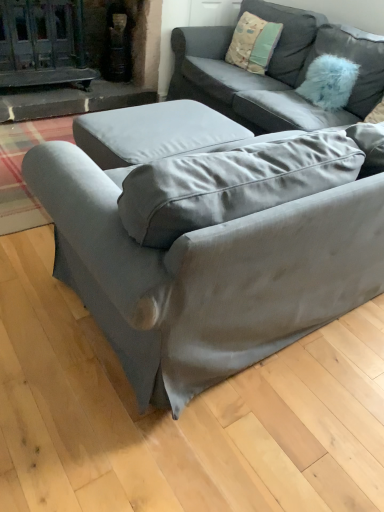
Question: Is textured cotton pillow at upper right, acting as the second pillow starting from the right, to the right of satin gray couch at center, acting as the 2th studio couch starting from the back, from the viewer's perspective?

Choices:
 (A) no
 (B) yes

Answer: (B)

Question: Does textured cotton pillow at upper right, acting as the 1th pillow starting from the left, turn towards satin gray couch at center, the 1th studio couch in the front-to-back sequence?

Choices:
 (A) yes
 (B) no

Answer: (B)

Question: Is textured cotton pillow at upper right, acting as the 1th pillow starting from the left, touching satin gray couch at center, acting as the 2th studio couch starting from the back?

Choices:
 (A) no
 (B) yes

Answer: (A)

Question: Does textured cotton pillow at upper right, acting as the second pillow starting from the right, lie behind satin gray couch at center, the 1th studio couch in the front-to-back sequence?

Choices:
 (A) no
 (B) yes

Answer: (B)

Question: Can you confirm if textured cotton pillow at upper right, acting as the second pillow starting from the right, is positioned to the left of satin gray couch at center, acting as the 2th studio couch starting from the back?

Choices:
 (A) yes
 (B) no

Answer: (B)

Question: Are textured cotton pillow at upper right, acting as the 1th pillow starting from the left, and satin gray couch at center, the 1th studio couch in the front-to-back sequence, far apart?

Choices:
 (A) yes
 (B) no

Answer: (A)

Question: Is textured cotton pillow at upper right, acting as the second pillow starting from the right, at the right side of satin gray couch at center, acting as the first studio couch starting from the back?

Choices:
 (A) no
 (B) yes

Answer: (A)

Question: Is textured cotton pillow at upper right, acting as the 1th pillow starting from the left, thinner than satin gray couch at center, acting as the first studio couch starting from the back?

Choices:
 (A) no
 (B) yes

Answer: (B)

Question: Can you confirm if textured cotton pillow at upper right, acting as the second pillow starting from the right, is wider than satin gray couch at center, the second studio couch in the front-to-back sequence?

Choices:
 (A) yes
 (B) no

Answer: (B)

Question: Is textured cotton pillow at upper right, acting as the second pillow starting from the right, placed right next to satin gray couch at center, the second studio couch in the front-to-back sequence?

Choices:
 (A) yes
 (B) no

Answer: (B)

Question: Would you say textured cotton pillow at upper right, acting as the 1th pillow starting from the left, is outside satin gray couch at center, acting as the first studio couch starting from the back?

Choices:
 (A) no
 (B) yes

Answer: (A)

Question: Does textured cotton pillow at upper right, acting as the second pillow starting from the right, have a larger size compared to satin gray couch at center, acting as the first studio couch starting from the back?

Choices:
 (A) yes
 (B) no

Answer: (B)

Question: From a real-world perspective, is fuzzy blue pillow at upper right, which is counted as the first pillow, starting from the right, physically above textured cotton pillow at upper right, acting as the second pillow starting from the right?

Choices:
 (A) no
 (B) yes

Answer: (A)